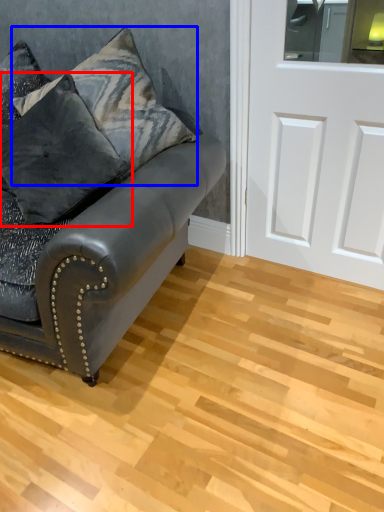
Question: Which of the following is the farthest to the observer, pillow (highlighted by a red box) or pillow (highlighted by a blue box)?

Choices:
 (A) pillow
 (B) pillow

Answer: (B)